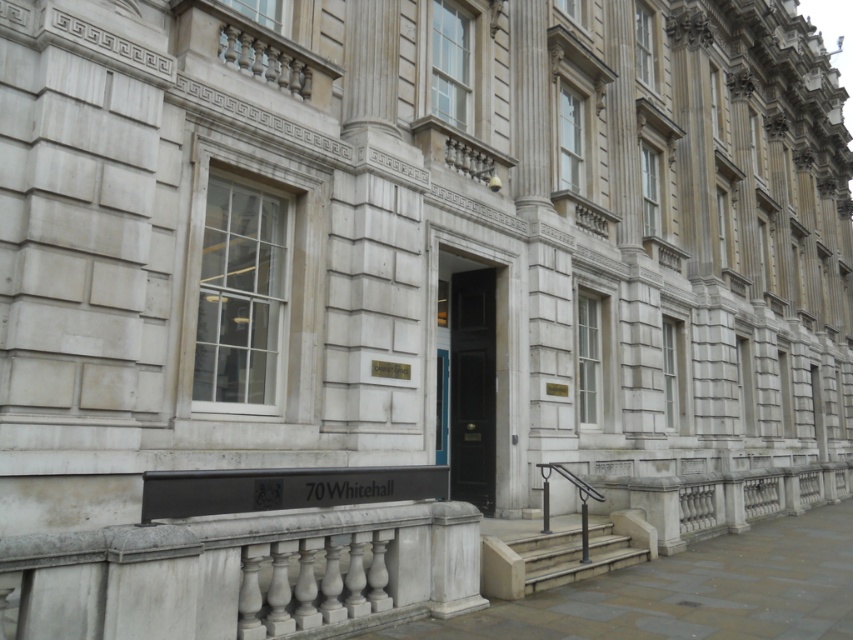
Question: Which point is farther to the camera?

Choices:
 (A) smooth concrete stairs at center
 (B) black polished wood door at center

Answer: (B)

Question: Among these points, which one is nearest to the camera?

Choices:
 (A) (469, 342)
 (B) (567, 531)

Answer: (B)

Question: Can you confirm if black polished wood door at center is smaller than smooth concrete stairs at center?

Choices:
 (A) yes
 (B) no

Answer: (A)

Question: Is the position of black polished wood door at center more distant than that of smooth concrete stairs at center?

Choices:
 (A) no
 (B) yes

Answer: (B)

Question: Which point is farther to the camera?

Choices:
 (A) (485, 445)
 (B) (572, 570)

Answer: (A)

Question: Can you confirm if black polished wood door at center is wider than smooth concrete stairs at center?

Choices:
 (A) yes
 (B) no

Answer: (B)